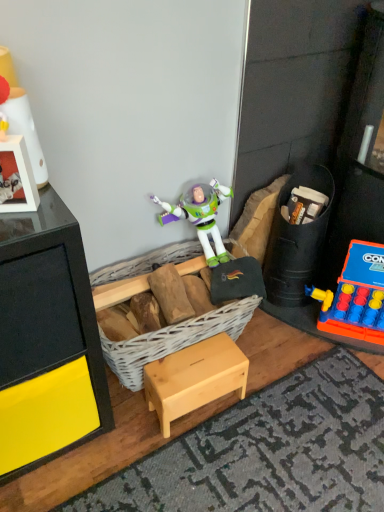
Question: From a real-world perspective, is rubberized plastic game at right, which appears as the 2th toy when viewed from the back, positioned above or below matte white lamp at upper left, acting as the first toy starting from the left?

Choices:
 (A) below
 (B) above

Answer: (A)

Question: Would you say rubberized plastic game at right, the third toy from the left, is to the left or to the right of matte white lamp at upper left, arranged as the third toy when viewed from the right, in the picture?

Choices:
 (A) left
 (B) right

Answer: (B)

Question: Which is farther from the white wicker basket at center?

Choices:
 (A) rubberized plastic game at right, positioned as the first toy in right-to-left order
 (B) natural wood stool at center
 (C) matte white lamp at upper left, which appears as the first toy when viewed from the front
 (D) rubberized plastic toy at right, which is the second toy from left to right

Answer: (C)

Question: Which object is positioned farthest from the rubberized plastic game at right, the third toy from the left?

Choices:
 (A) natural wood stool at center
 (B) rubberized plastic toy at right, which is the second toy from left to right
 (C) white wicker basket at center
 (D) matte white lamp at upper left, arranged as the third toy when viewed from the right

Answer: (D)